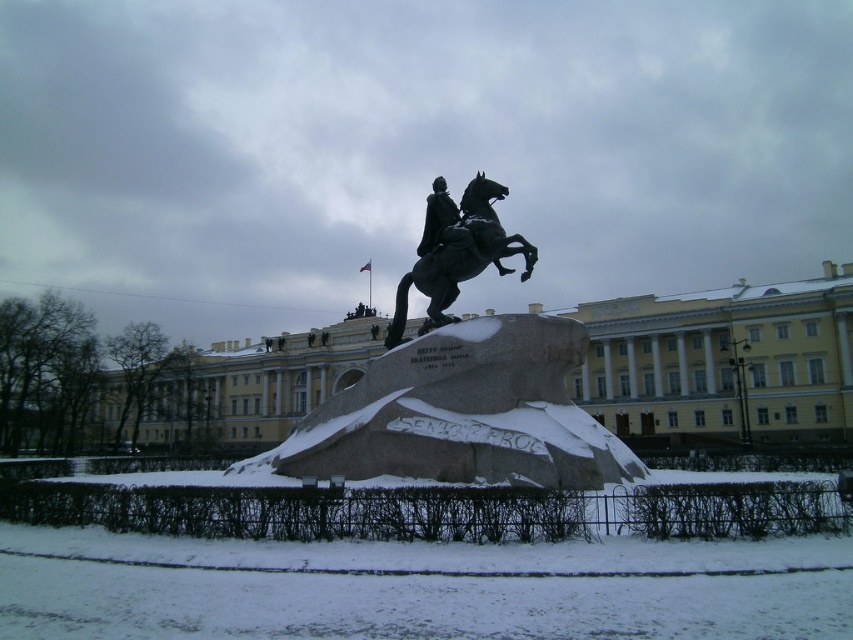
Question: Which object appears farthest from the camera in this image?

Choices:
 (A) bronze statue at center
 (B) black polished statue at center
 (C) black polished stone horse at center

Answer: (B)

Question: Based on their relative distances, which object is nearer to the black polished stone horse at center?

Choices:
 (A) black polished statue at center
 (B) bronze statue at center

Answer: (A)

Question: Does bronze statue at center have a lesser width compared to black polished stone horse at center?

Choices:
 (A) no
 (B) yes

Answer: (A)

Question: Is black polished stone horse at center wider than black polished statue at center?

Choices:
 (A) yes
 (B) no

Answer: (A)

Question: Does black polished stone horse at center have a smaller size compared to black polished statue at center?

Choices:
 (A) yes
 (B) no

Answer: (B)

Question: Which of the following is the farthest from the observer?

Choices:
 (A) bronze statue at center
 (B) black polished statue at center
 (C) black polished stone horse at center

Answer: (B)